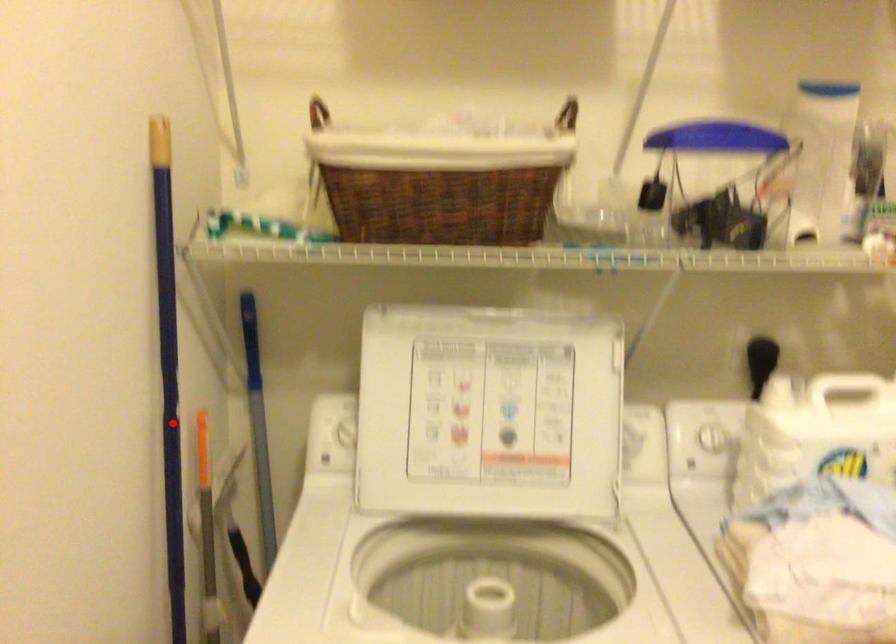
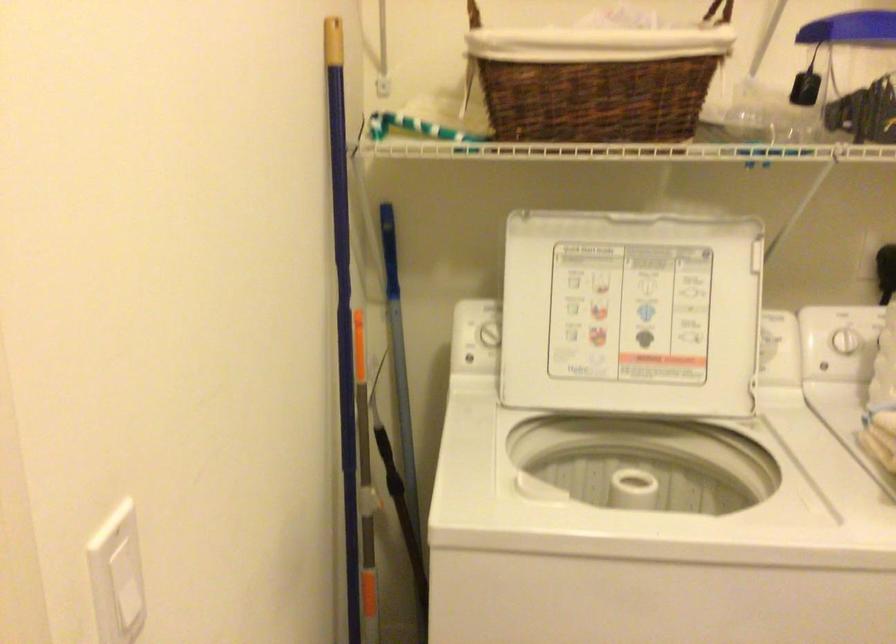
Locate, in the second image, the point that corresponds to the highlighted location in the first image.

(343, 316)